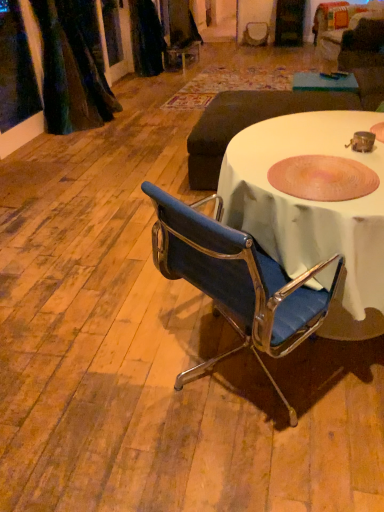
Question: Relative to pink textured bowl at center, is green felt table at upper center in front or behind?

Choices:
 (A) behind
 (B) front

Answer: (A)

Question: Does point (349, 89) appear closer or farther from the camera than point (284, 180)?

Choices:
 (A) closer
 (B) farther

Answer: (B)

Question: Considering the real-world distances, which object is farthest from the blue fabric chair at center?

Choices:
 (A) green felt table at upper center
 (B) dark gray fabric ottoman at center
 (C) velvet dark green curtain at upper left
 (D) pink textured bowl at center

Answer: (C)

Question: Which object is positioned closest to the green felt table at upper center?

Choices:
 (A) pink textured bowl at center
 (B) velvet dark green curtain at upper left
 (C) blue fabric chair at center
 (D) dark gray fabric ottoman at center

Answer: (D)